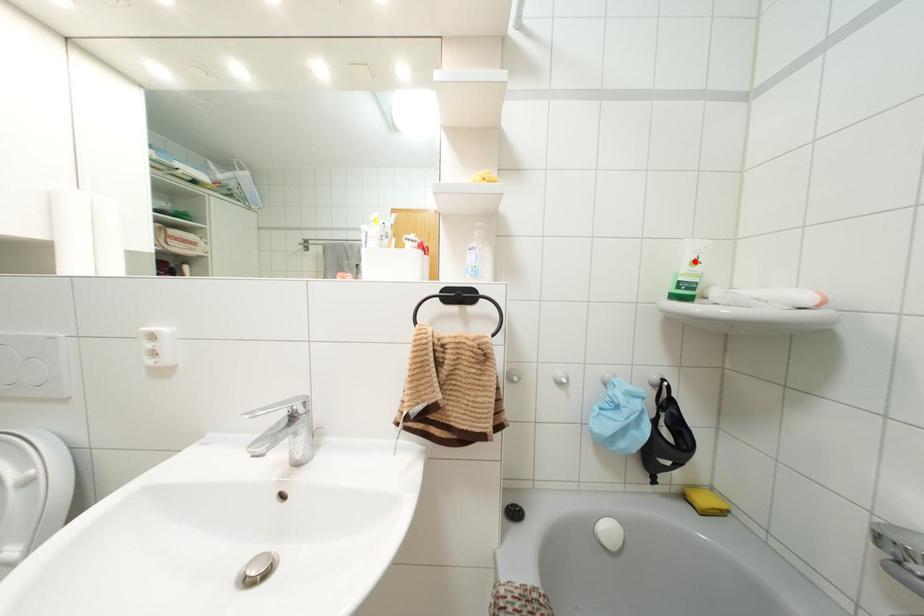
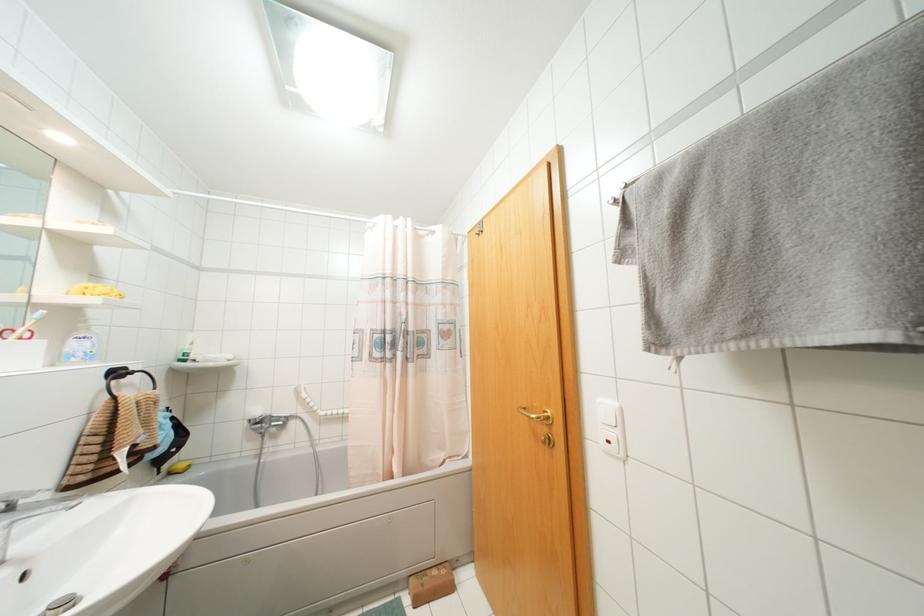
Locate, in the second image, the point that corresponds to the highlighted location in the first image.

(190, 342)